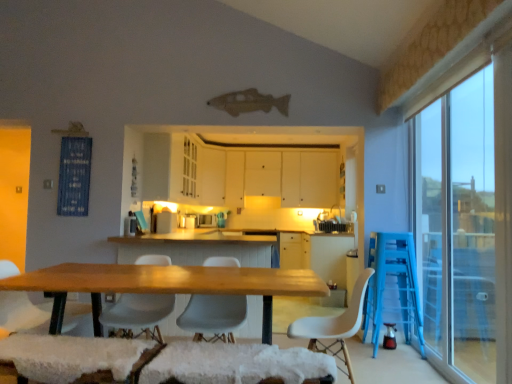
Question: Is the depth of white fabric chair at lower left, placed as the 1th chair when sorted from left to right, less than that of white plastic chair at center, arranged as the 1th chair when viewed from the right?

Choices:
 (A) no
 (B) yes

Answer: (A)

Question: From a real-world perspective, is white fabric chair at lower left, placed as the 1th chair when sorted from left to right, over white plastic chair at center, the 4th chair positioned from the left?

Choices:
 (A) no
 (B) yes

Answer: (A)

Question: Does white fabric chair at lower left, arranged as the fourth chair when viewed from the right, touch white plastic chair at center, arranged as the 1th chair when viewed from the right?

Choices:
 (A) no
 (B) yes

Answer: (A)

Question: From the image's perspective, is white fabric chair at lower left, placed as the 1th chair when sorted from left to right, on top of white plastic chair at center, arranged as the 1th chair when viewed from the right?

Choices:
 (A) no
 (B) yes

Answer: (B)

Question: From the image's perspective, is white fabric chair at lower left, placed as the 1th chair when sorted from left to right, located beneath white plastic chair at center, arranged as the 1th chair when viewed from the right?

Choices:
 (A) yes
 (B) no

Answer: (B)

Question: Would you say wooden table at center is to the left or to the right of white matte cabinet at center, the first cabinetry when ordered from back to front, in the picture?

Choices:
 (A) left
 (B) right

Answer: (B)

Question: Is wooden table at center bigger or smaller than white matte cabinet at center, the first cabinetry when ordered from back to front?

Choices:
 (A) small
 (B) big

Answer: (B)

Question: Is wooden table at center taller or shorter than white matte cabinet at center, the first cabinetry when ordered from back to front?

Choices:
 (A) tall
 (B) short

Answer: (B)

Question: In the image, is wooden table at center positioned in front of or behind white matte cabinet at center, the first cabinetry when ordered from back to front?

Choices:
 (A) front
 (B) behind

Answer: (A)

Question: Looking at their shapes, would you say white fabric chair at lower left, placed as the 1th chair when sorted from left to right, is wider or thinner than blue fabric at upper left?

Choices:
 (A) thin
 (B) wide

Answer: (B)

Question: Considering their positions, is white fabric chair at lower left, arranged as the fourth chair when viewed from the right, located in front of or behind blue fabric at upper left?

Choices:
 (A) behind
 (B) front

Answer: (B)

Question: Looking at the image, does white fabric chair at lower left, placed as the 1th chair when sorted from left to right, seem bigger or smaller compared to blue fabric at upper left?

Choices:
 (A) big
 (B) small

Answer: (A)

Question: Considering the positions of point (10, 296) and point (58, 203), is point (10, 296) closer or farther from the camera than point (58, 203)?

Choices:
 (A) closer
 (B) farther

Answer: (A)

Question: From a real-world perspective, is transparent glass window at right physically located above or below white matte chair at center, which appears as the 3th chair when viewed from the right?

Choices:
 (A) above
 (B) below

Answer: (A)

Question: Is transparent glass window at right taller or shorter than white matte chair at center, which appears as the 3th chair when viewed from the right?

Choices:
 (A) tall
 (B) short

Answer: (A)